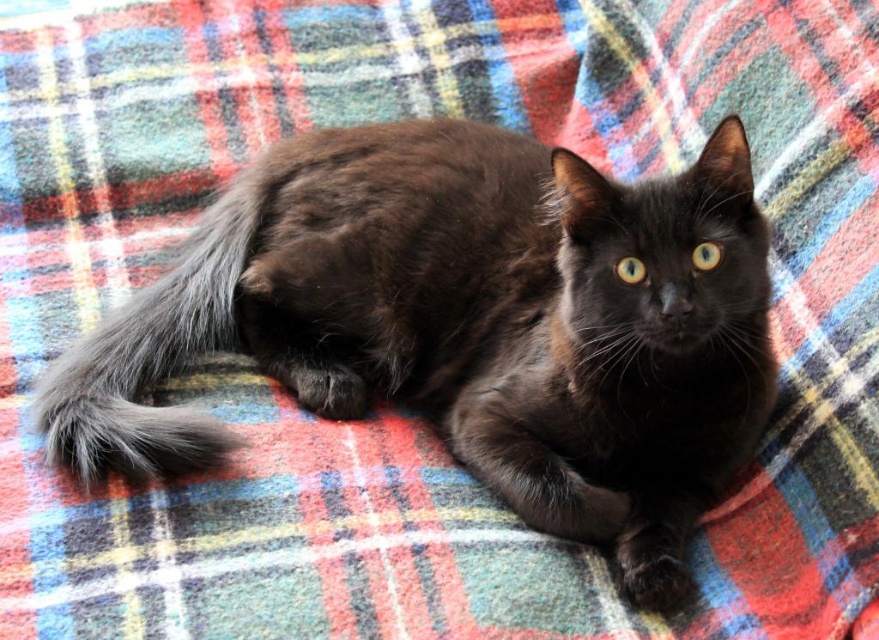
You are looking at the image of the cat on the blanket. There are two points marked in the image. Which point is closer to you, point (x=541, y=484) or point (x=237, y=179)?

Point (x=541, y=484) is closer to the viewer than point (x=237, y=179).